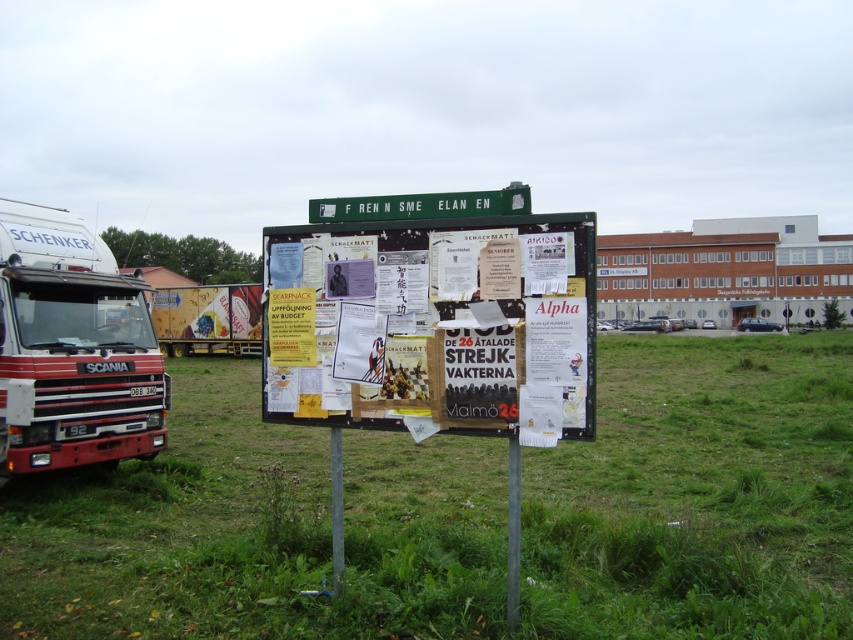
You are standing in front of the bulletin board and want to take a photo of the metallic silver truck at left without including the green grassy at left in the frame. How should you adjust your camera angle?

To exclude the green grassy at left from the frame while capturing the metallic silver truck at left, you should angle your camera upwards since the green grassy at left is positioned below the metallic silver truck at left.

You are standing at the center of the image. Which direction should you move to reach the green grassy at left?

The green grassy at left is located at point (x=257, y=531), so you should move to the left to reach it.